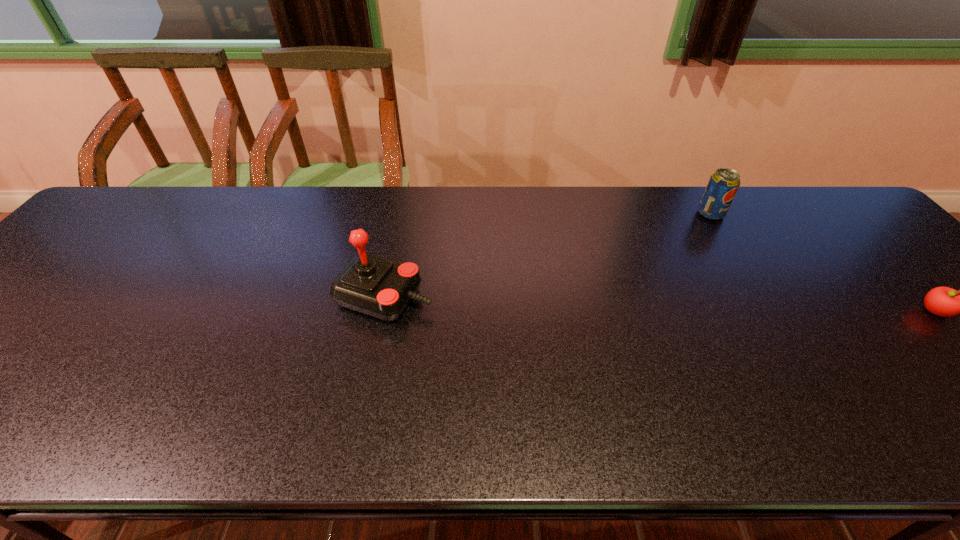
What are the coordinates of `object that ranks as the second closest to the rightmost object` in the screenshot? It's located at (382, 288).

Locate which object ranks second in proximity to the shortest object. Please provide its 2D coordinates. Your answer should be formatted as a tuple, i.e. [(x, y)], where the tuple contains the x and y coordinates of a point satisfying the conditions above.

[(382, 288)]